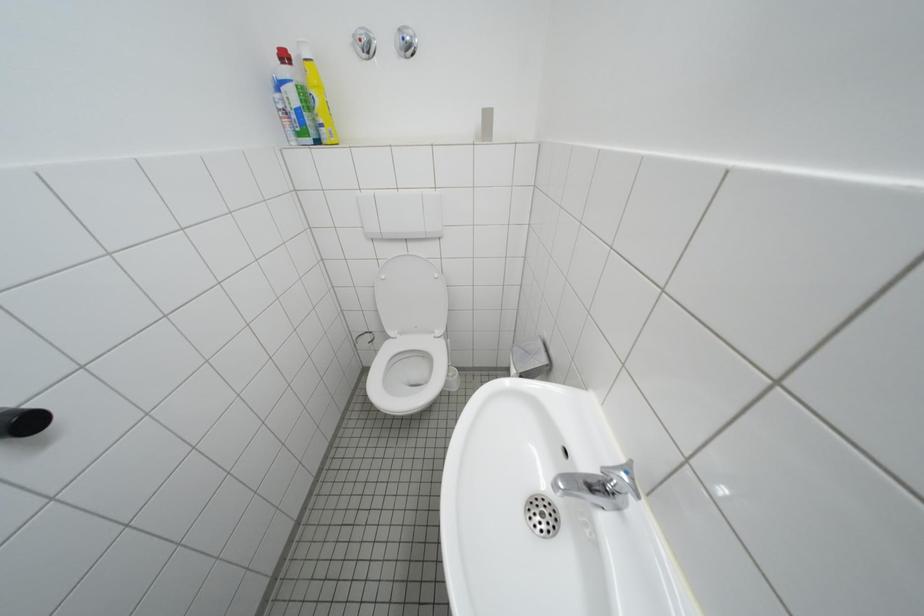
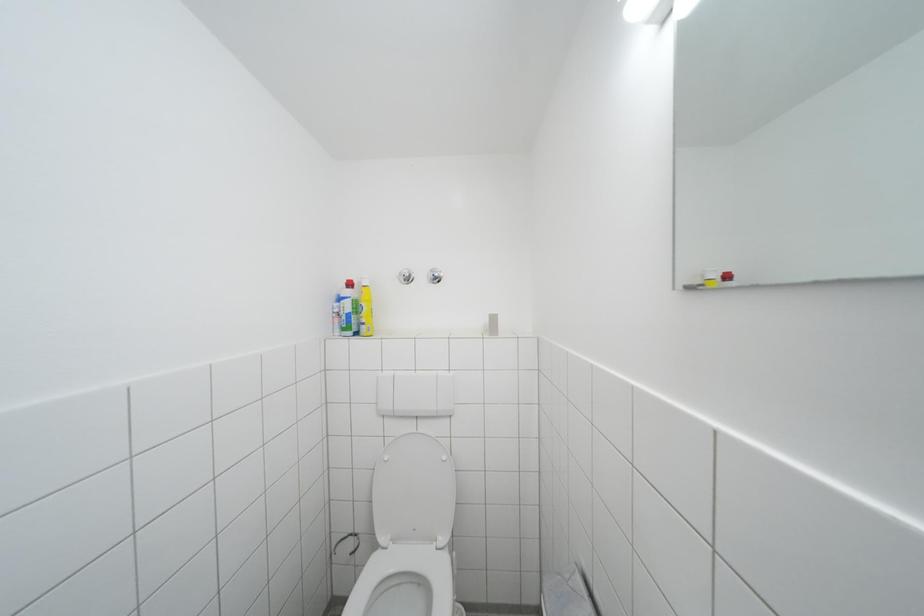
Question: Based on the continuous images, in which direction is the camera rotating? Reply with the corresponding letter.

Choices:
 (A) Left
 (B) Right
 (C) Up
 (D) Down

Answer: (C)